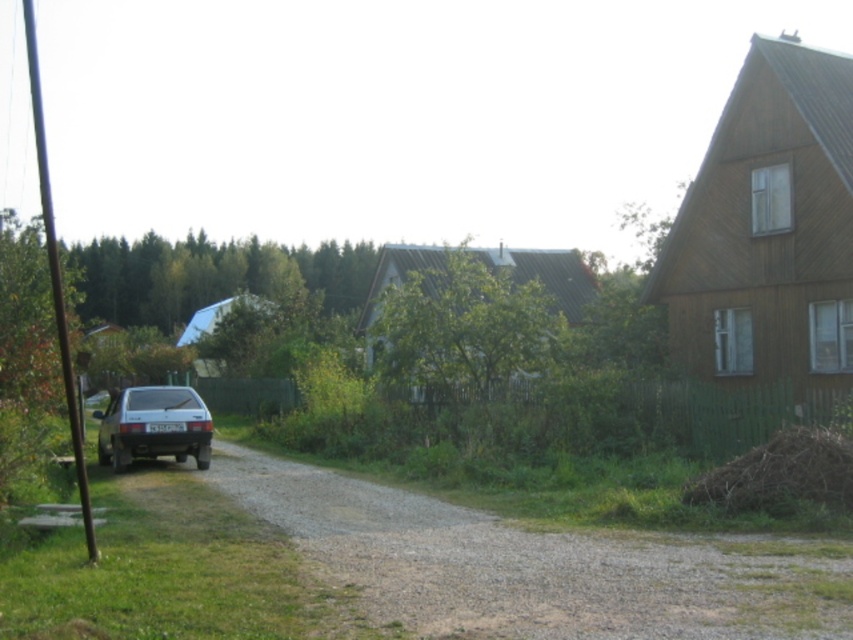
Question: Which object appears farthest from the camera in this image?

Choices:
 (A) gray gravel driveway at lower left
 (B) brown dry hay at right
 (C) satin silver car at left

Answer: (C)

Question: Is brown dry hay at right positioned before satin silver car at left?

Choices:
 (A) no
 (B) yes

Answer: (B)

Question: Among these objects, which one is nearest to the camera?

Choices:
 (A) satin silver car at left
 (B) gray gravel driveway at lower left

Answer: (B)

Question: Which object is farther from the camera taking this photo?

Choices:
 (A) brown dry hay at right
 (B) satin silver car at left
 (C) gray gravel driveway at lower left

Answer: (B)

Question: Does gray gravel driveway at lower left have a greater width compared to satin silver car at left?

Choices:
 (A) no
 (B) yes

Answer: (B)

Question: Is gray gravel driveway at lower left to the left of satin silver car at left from the viewer's perspective?

Choices:
 (A) no
 (B) yes

Answer: (A)